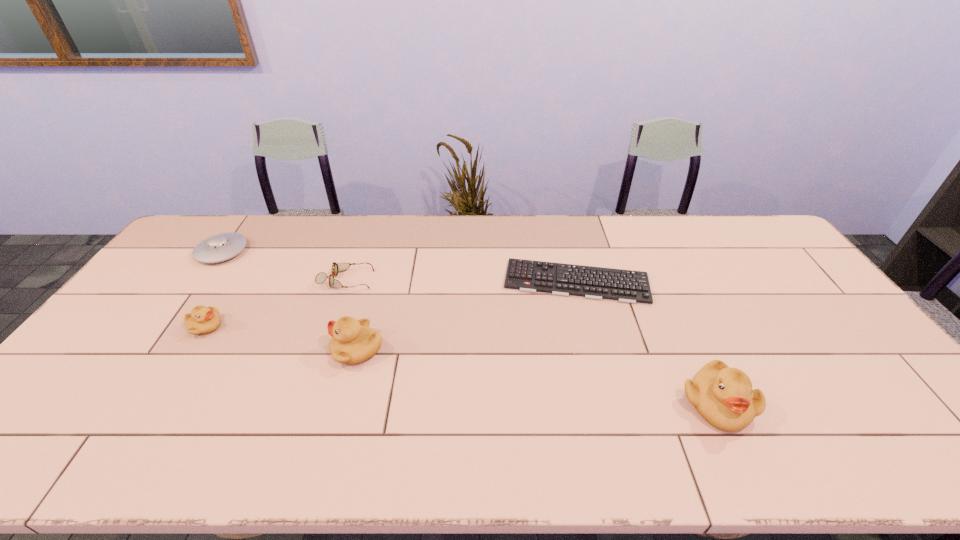
To achieve even spacing by inserting another duckling among them, please point to a vacant spot for this new duckling. Please provide its 2D coordinates. Your answer should be formatted as a tuple, i.e. [(x, y)], where the tuple contains the x and y coordinates of a point satisfying the conditions above.

[(527, 375)]